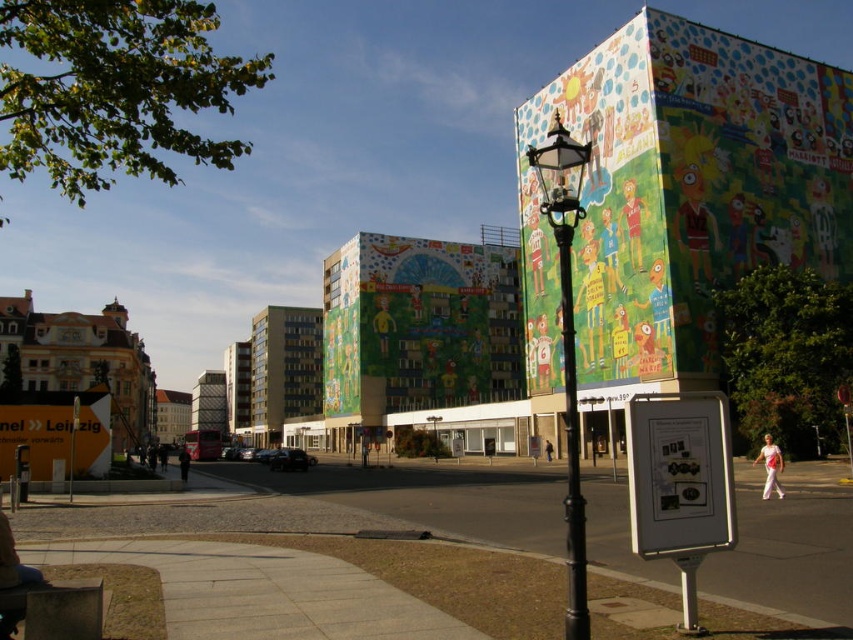
Is smooth concrete pavement at lower left to the left of polished brass lamp post at center-right from the viewer's perspective?

Correct, you'll find smooth concrete pavement at lower left to the left of polished brass lamp post at center-right.

Who is more distant from viewer, [468,484] or [527,157]?

The point [527,157] is more distant.

Who is more forward, (775, 602) or (567, 212)?

Point (567, 212) is in front.

At what (x,y) coordinates should I click in order to perform the action: click on smooth concrete pavement at lower left. Please return your answer as a coordinate pair (x, y). The width and height of the screenshot is (853, 640). Looking at the image, I should click on (434, 497).